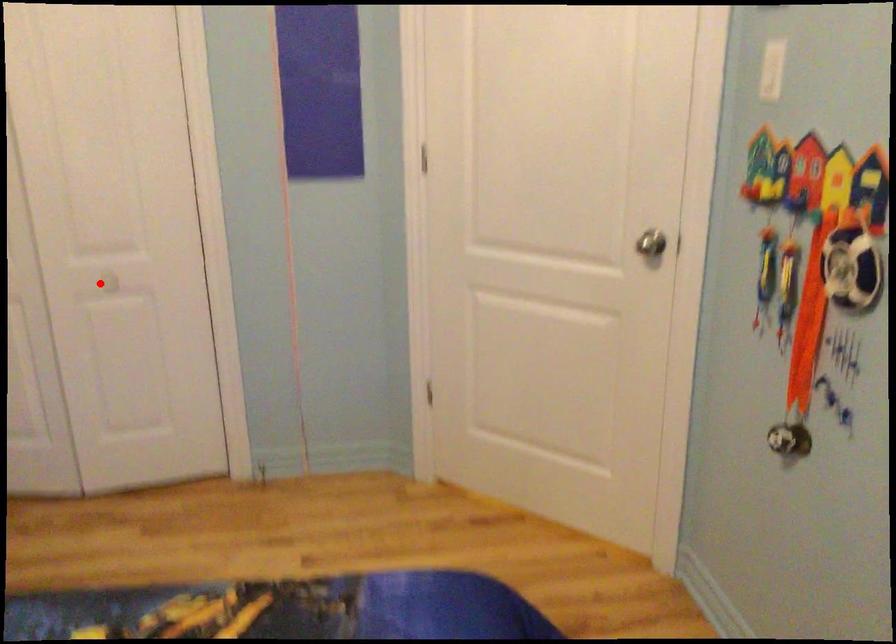
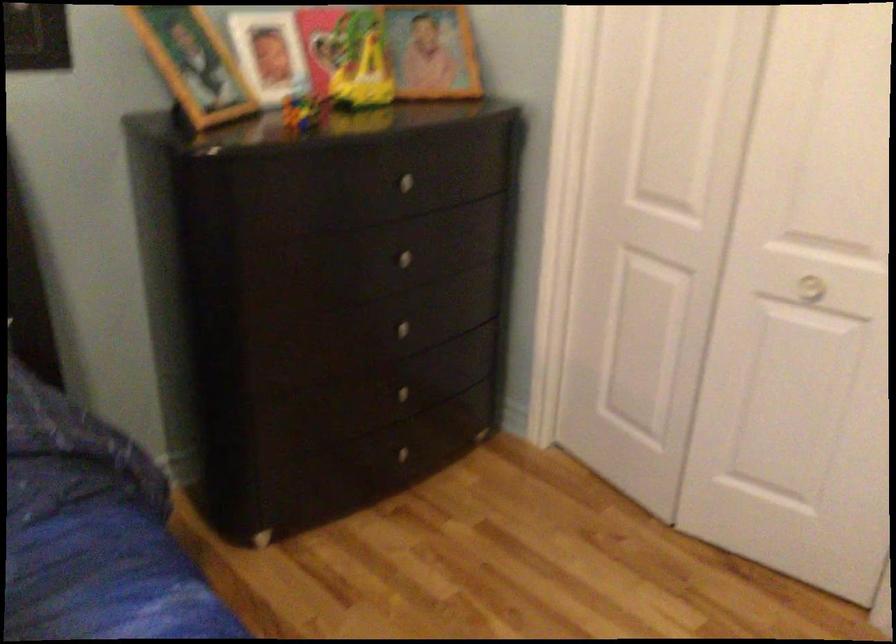
Question: I am providing you with two images of the same scene from different viewpoints. A red point is shown in image1. For the corresponding object point in image2, is it positioned nearer or farther from the camera?

Choices:
 (A) Nearer
 (B) Farther

Answer: (A)